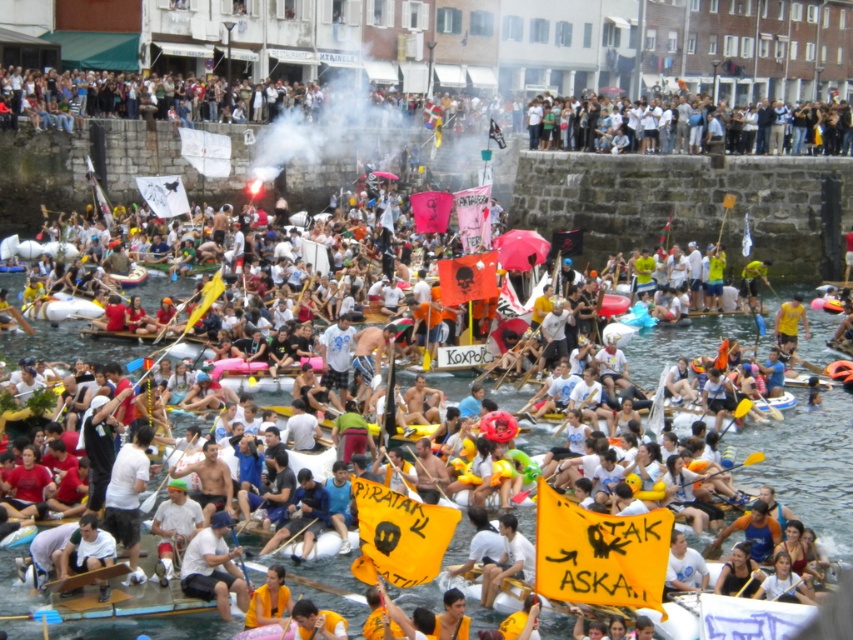
You are a photographer at the water festival aiming to capture the most impactful image. You have two subjects in view through your lens, the white cotton crowd at upper center and the white fabric shirt at center. Which subject should you focus on to ensure it stands out more in the photo?

The white cotton crowd at upper center has a larger size compared to the white fabric shirt at center, so focusing on the white cotton crowd at upper center will make it stand out more in the photo.

You are a photographer standing on the dock and want to capture a photo of the white cotton crowd at upper center and the white fabric shirt at center. Which one will appear larger in the photo?

The white cotton crowd at upper center will appear larger in the photo because it is much taller than the white fabric shirt at center.

You are a photographer trying to capture the most crowded part of the water festival. You see the white cotton crowd at upper center and the yellow fabric paddle at center. Which object should you focus on to capture the most crowded area?

The white cotton crowd at upper center has a larger size compared to the yellow fabric paddle at center, so focusing on the white cotton crowd at upper center will capture the most crowded area.